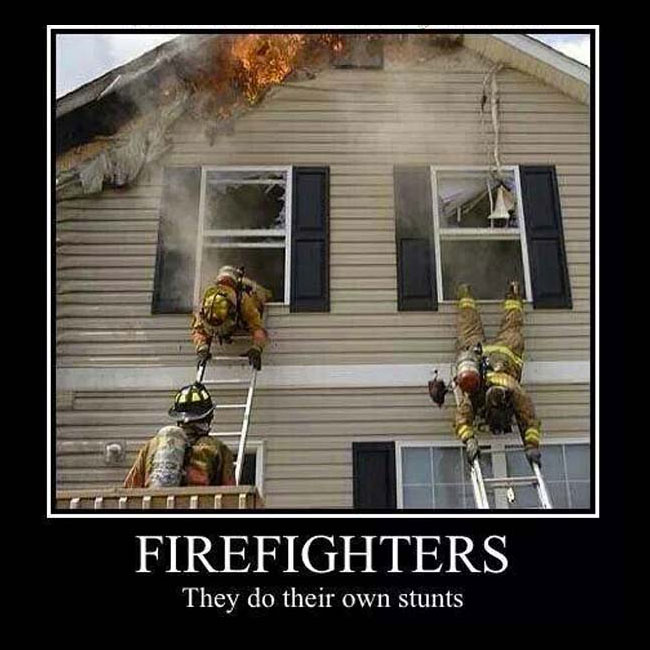
You are a GUI agent. You are given a task and a screenshot of the screen. Output one action in this format:
    pyautogui.click(x=<x>, y=<y>)
    Task: Click on the ceiling
    The width and height of the screenshot is (650, 650).
    Given the screenshot: What is the action you would take?
    pyautogui.click(x=151, y=71), pyautogui.click(x=525, y=51)